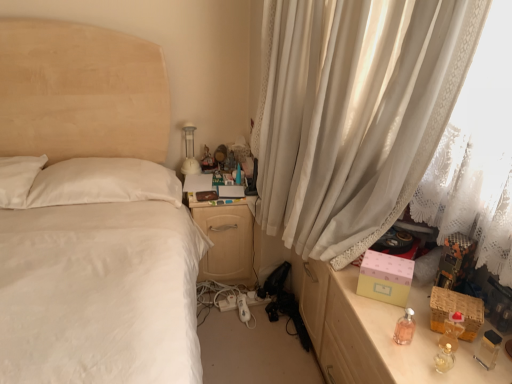
Where is `unoccupied area behind pink glass perfume at lower right, which is the second perfume in right-to-left order`? unoccupied area behind pink glass perfume at lower right, which is the second perfume in right-to-left order is located at coordinates (383, 306).